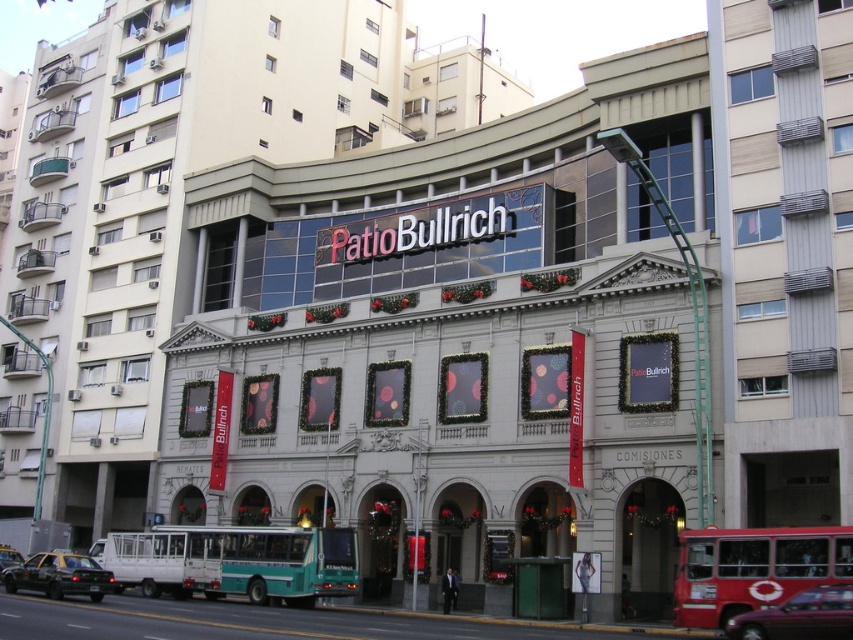
Question: Which point is closer to the camera?

Choices:
 (A) (33, 563)
 (B) (9, 564)
 (C) (735, 545)

Answer: (C)

Question: Which object appears farthest from the camera in this image?

Choices:
 (A) teal matte bus at lower center
 (B) black rubber car at lower left
 (C) red rubber bus at lower right

Answer: (A)

Question: Where is red rubber bus at lower right located in relation to teal matte bus at lower center in the image?

Choices:
 (A) below
 (B) above

Answer: (B)

Question: Does metallic red car at lower right have a lesser width compared to black rubber car at lower left?

Choices:
 (A) no
 (B) yes

Answer: (B)

Question: Does teal matte bus at lower center lie in front of black rubber car at lower left?

Choices:
 (A) no
 (B) yes

Answer: (A)

Question: Which is nearer to the teal matte bus at lower center?

Choices:
 (A) black rubber car at lower left
 (B) black glossy car at lower left

Answer: (A)